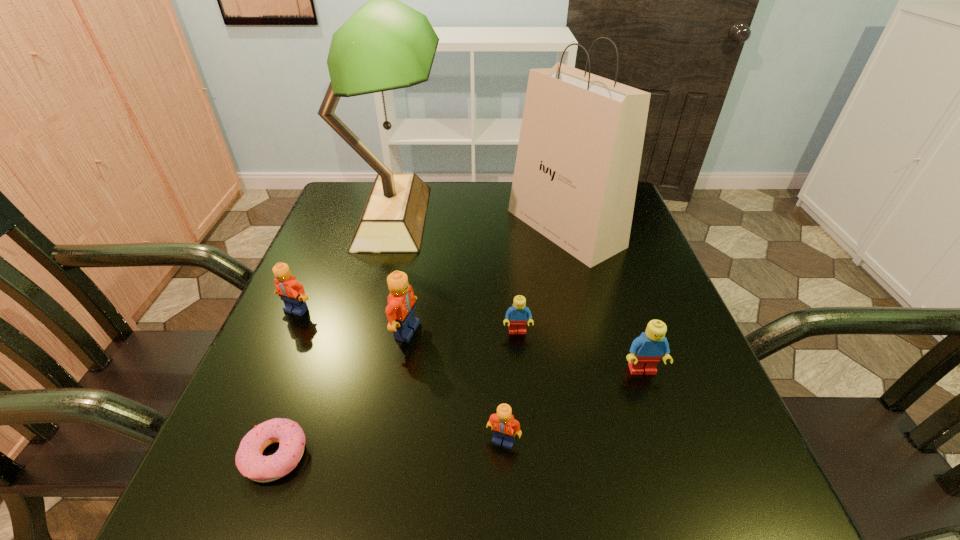
Where is `free space between the smaller blue Lego and the green table lamp`? Image resolution: width=960 pixels, height=540 pixels. free space between the smaller blue Lego and the green table lamp is located at coordinates (455, 274).

Where is `free space between the second biggest orange Lego and the right blue Lego`? This screenshot has height=540, width=960. free space between the second biggest orange Lego and the right blue Lego is located at coordinates (469, 340).

Locate an element on the screen. This screenshot has height=540, width=960. vacant space that's between the pink doughnut and the leftmost Lego is located at coordinates (286, 383).

Where is `blank region between the green table lamp and the left blue Lego`? blank region between the green table lamp and the left blue Lego is located at coordinates (455, 274).

Identify the location of free space between the nearest Lego and the smaller blue Lego. point(511,386).

Image resolution: width=960 pixels, height=540 pixels. I want to click on vacant area between the nearer blue Lego and the shopping bag, so 604,299.

Image resolution: width=960 pixels, height=540 pixels. In order to click on free space that is in between the smallest orange Lego and the pink doughnut in this screenshot , I will do `click(390, 448)`.

This screenshot has height=540, width=960. What are the coordinates of `the closest object relative to the table lamp` in the screenshot? It's located at (292, 293).

The image size is (960, 540). I want to click on object that is the fifth closest to the tallest Lego, so click(x=503, y=424).

You are a GUI agent. You are given a task and a screenshot of the screen. Output one action in this format:
    pyautogui.click(x=<x>, y=<y>)
    Task: Click on the second closest Lego to the second Lego from left to right
    
    Given the screenshot: What is the action you would take?
    pyautogui.click(x=292, y=293)